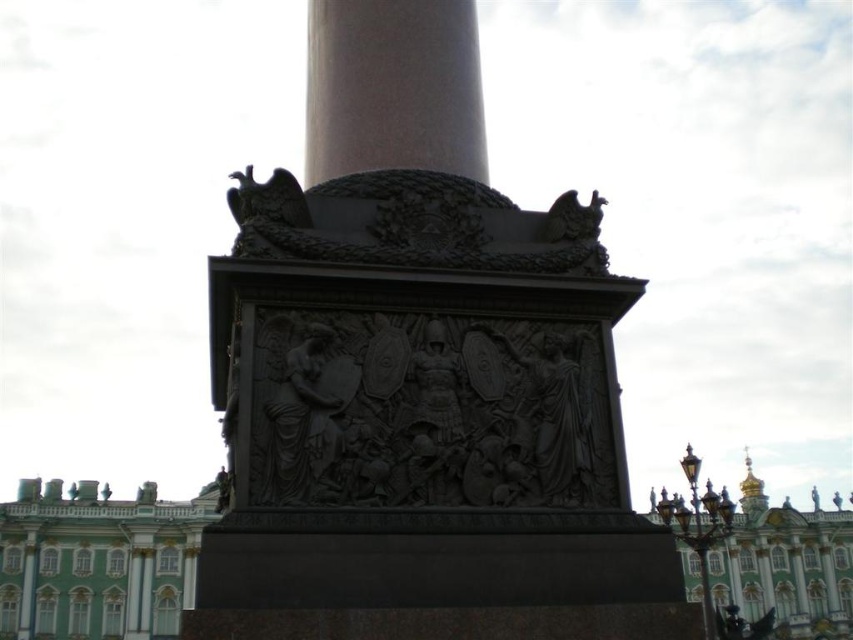
Locate an element on the screen. Image resolution: width=853 pixels, height=640 pixels. smooth bronze column at center is located at coordinates (392, 88).

What do you see at coordinates (392, 88) in the screenshot? This screenshot has height=640, width=853. I see `smooth bronze column at center` at bounding box center [392, 88].

Does point (363, 102) come in front of point (177, 621)?

Yes.

Identify the location of smooth bronze column at center. (392, 88).

Consider the image. Between green polished stone palace at lower left and gold domed palace at center, which one is positioned lower?

green polished stone palace at lower left is below.

Measure the distance between point (13, 589) and camera.

Point (13, 589) and camera are 393.38 feet apart from each other.

Locate an element on the screen. The height and width of the screenshot is (640, 853). green polished stone palace at lower left is located at coordinates (97, 561).

What do you see at coordinates (422, 413) in the screenshot? The width and height of the screenshot is (853, 640). I see `black bas-relief sculpture at center` at bounding box center [422, 413].

Is black bas-relief sculpture at center taller than green polished stone palace at lower left?

Incorrect, black bas-relief sculpture at center's height is not larger of green polished stone palace at lower left's.

Which is behind, point (369, 323) or point (59, 582)?

Point (59, 582)

Identify the location of black bas-relief sculpture at center. (422, 413).